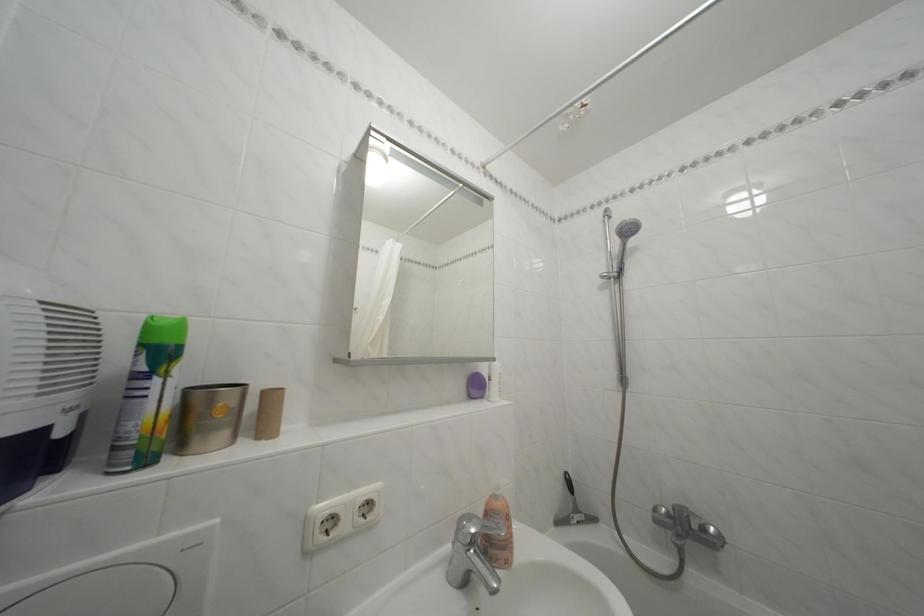
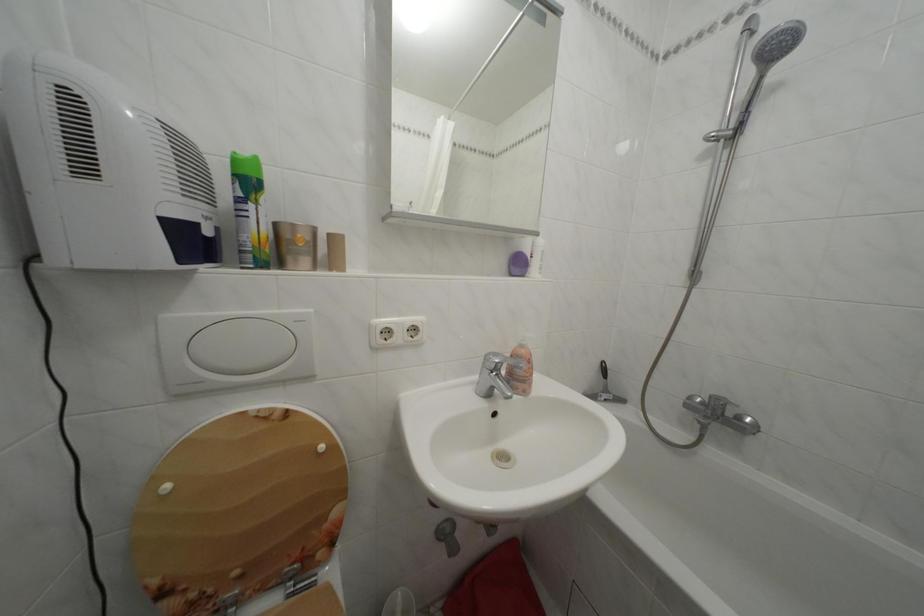
The point at (505, 504) is marked in the first image. Where is the corresponding point in the second image?

(530, 352)